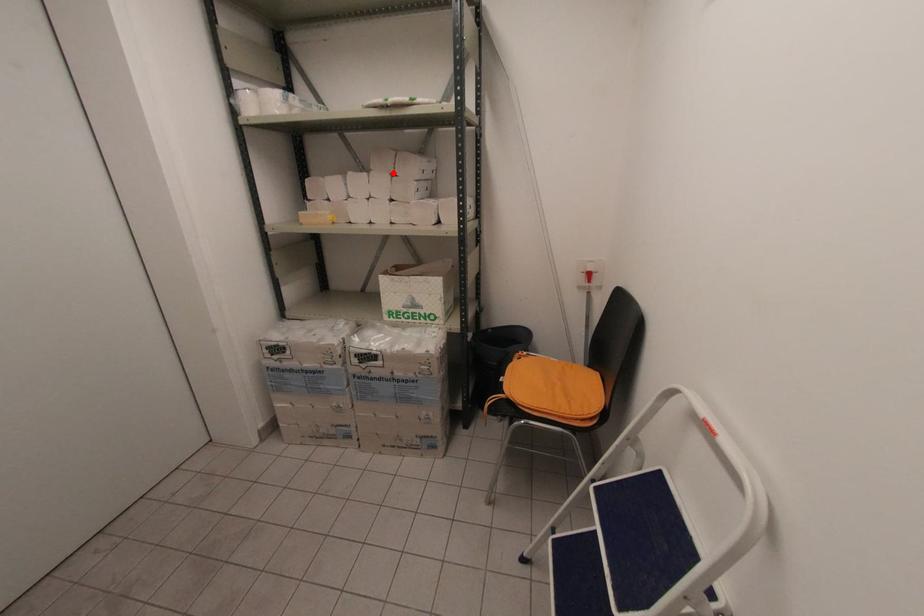
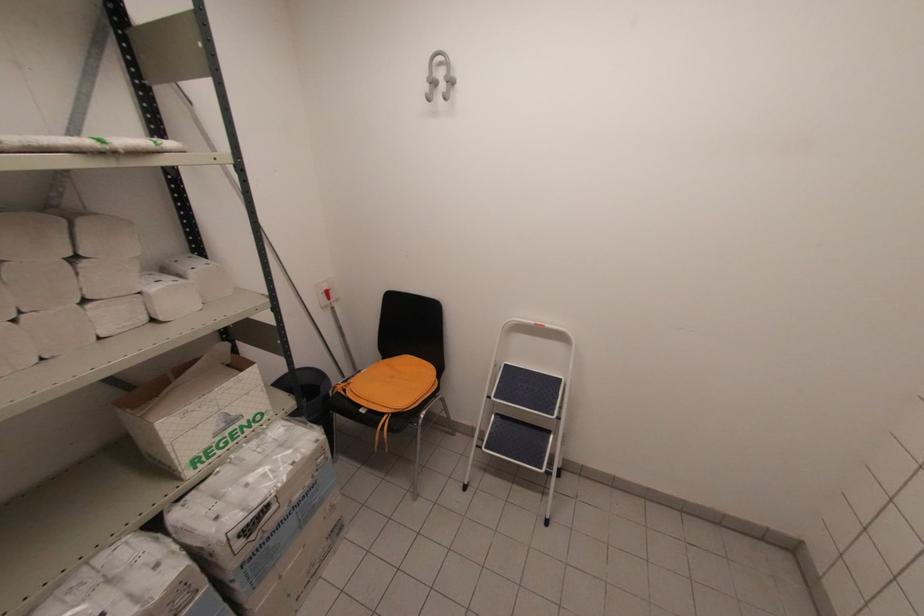
Question: A red point is marked in image1. In image2, is the corresponding 3D point closer to the camera or farther? Reply with the corresponding letter.

Choices:
 (A) The corresponding 3D point is closer.
 (B) The corresponding 3D point is farther.

Answer: (B)